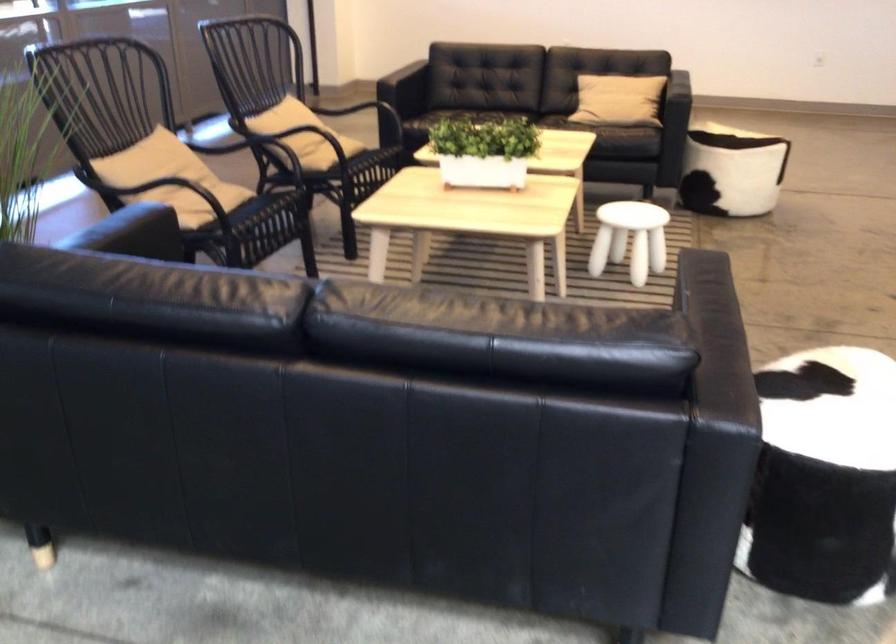
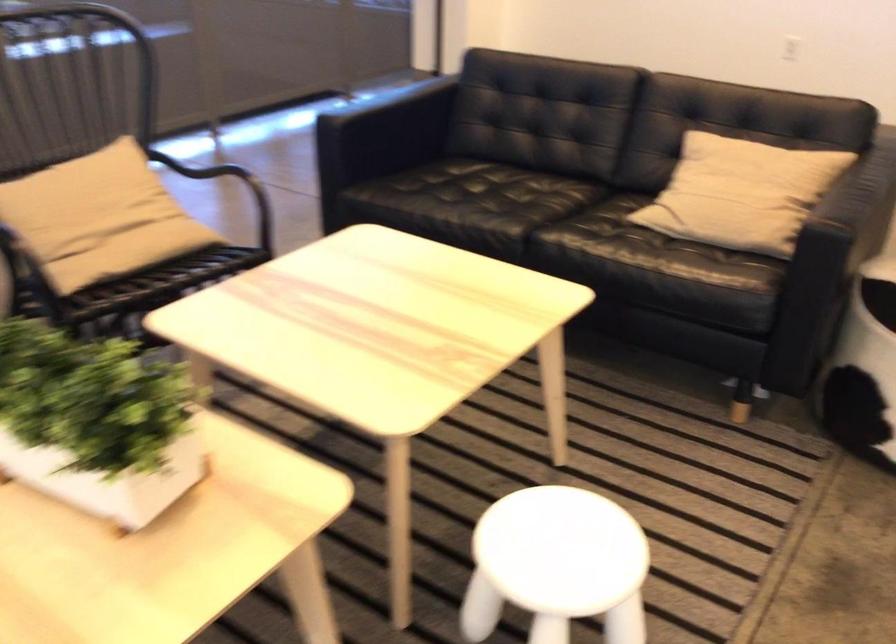
Where in the second image is the point corresponding to the point at 645,216 from the first image?

(556, 565)